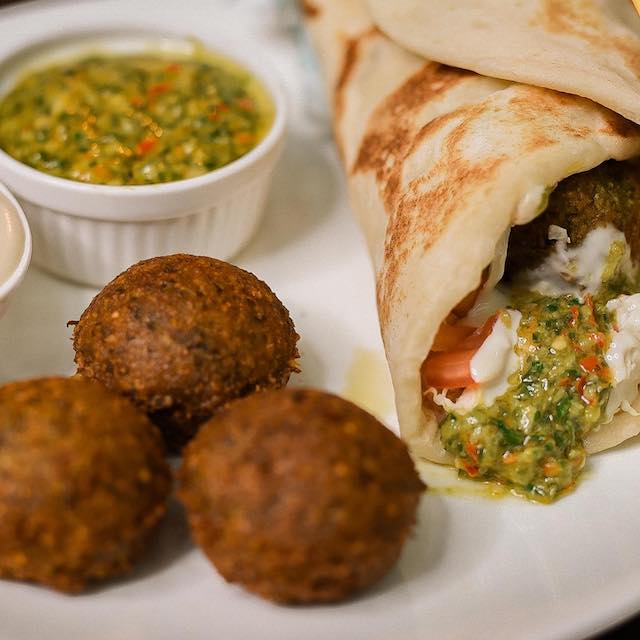
Identify the location of thing you eat food off of. (200, 617).